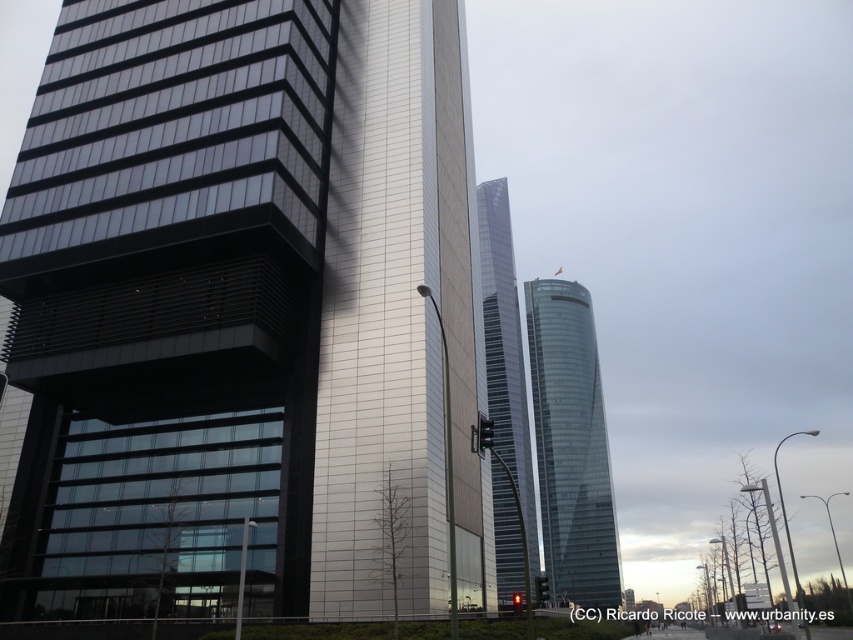
Question: Which of the following is the closest to the observer?

Choices:
 (A) transparent glass tower at center
 (B) glassy steel tower at center
 (C) glassy steel building at center

Answer: (B)

Question: In this image, where is transparent glass tower at center located relative to glassy steel tower at center?

Choices:
 (A) above
 (B) below

Answer: (B)

Question: Is glassy steel building at center wider than transparent glass tower at center?

Choices:
 (A) yes
 (B) no

Answer: (A)

Question: Is glassy steel building at center bigger than glassy steel tower at center?

Choices:
 (A) no
 (B) yes

Answer: (A)

Question: Which of the following is the farthest from the observer?

Choices:
 (A) glassy steel tower at center
 (B) transparent glass tower at center
 (C) glassy steel building at center

Answer: (B)

Question: Among these points, which one is farthest from the camera?

Choices:
 (A) (508, 484)
 (B) (405, 208)
 (C) (544, 438)

Answer: (C)